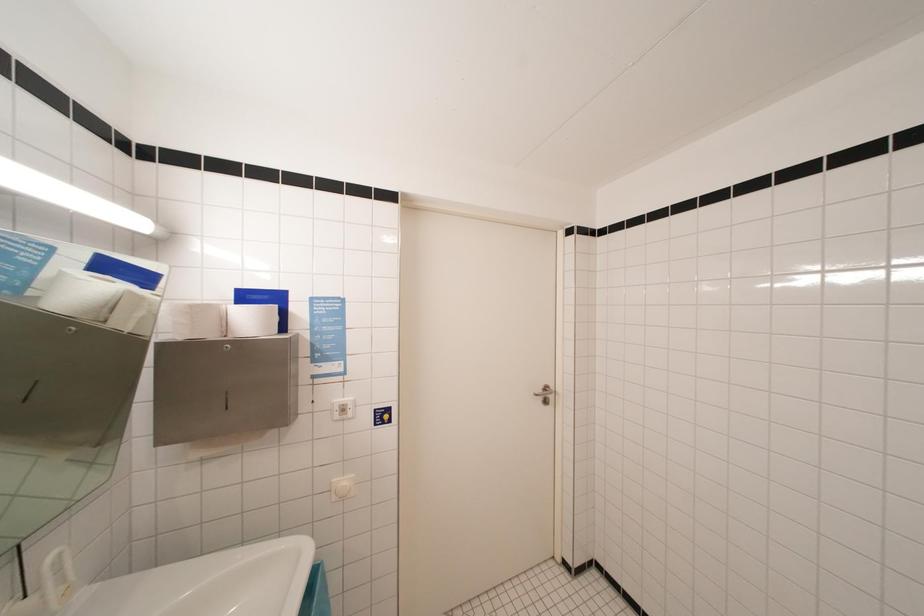
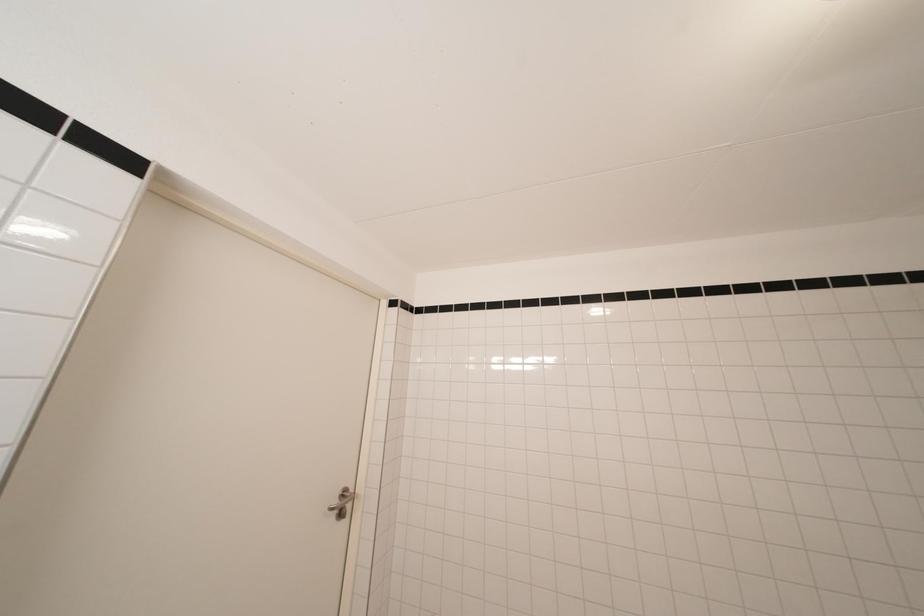
First-person continuous shooting, in which direction is the camera rotating?

The camera rotated toward right-up.